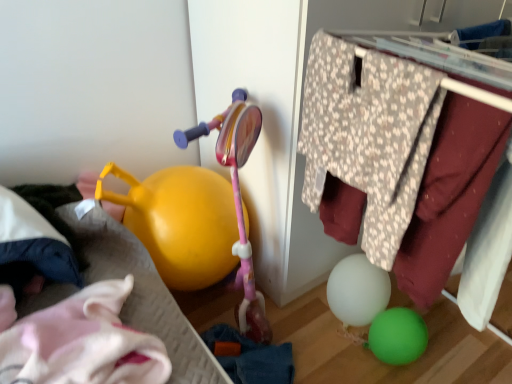
The width and height of the screenshot is (512, 384). What do you see at coordinates (104, 323) in the screenshot?
I see `yellow plastic watering can at left` at bounding box center [104, 323].

Measure the distance between floral fabric clothes hanger at upper right and camera.

floral fabric clothes hanger at upper right and camera are 57.02 centimeters apart.

What is the approximate height of floral fabric clothes hanger at upper right?

floral fabric clothes hanger at upper right is 48.06 centimeters in height.

You are a GUI agent. You are given a task and a screenshot of the screen. Output one action in this format:
    pyautogui.click(x=<x>, y=<y>)
    Task: Click on the white soft pillow at left
    
    Given the screenshot: What is the action you would take?
    pyautogui.click(x=34, y=240)

From the image's perspective, is yellow plastic watering can at left located above or below white soft pillow at left?

From the image's perspective, yellow plastic watering can at left appears below white soft pillow at left.

Is yellow plastic watering can at left oriented away from white soft pillow at left?

Correct, yellow plastic watering can at left is looking away from white soft pillow at left.

Considering the relative positions of yellow plastic watering can at left and white soft pillow at left in the image provided, is yellow plastic watering can at left to the left of white soft pillow at left from the viewer's perspective?

In fact, yellow plastic watering can at left is to the right of white soft pillow at left.

Considering the positions of objects yellow plastic watering can at left and white soft pillow at left in the image provided, who is in front, yellow plastic watering can at left or white soft pillow at left?

yellow plastic watering can at left is in front.

Locate an element on the screen. The width and height of the screenshot is (512, 384). closet above the yellow plastic watering can at left (from the image's perspective) is located at coordinates (411, 169).

How many degrees apart are the facing directions of yellow plastic watering can at left and floral fabric clothes hanger at upper right?

The angular difference between yellow plastic watering can at left and floral fabric clothes hanger at upper right is 1.08 degrees.

Can you confirm if yellow plastic watering can at left is wider than floral fabric clothes hanger at upper right?

Indeed, yellow plastic watering can at left has a greater width compared to floral fabric clothes hanger at upper right.

From a real-world perspective, which object rests below the other?

In real-world perspective, yellow plastic watering can at left is lower.

You are a GUI agent. You are given a task and a screenshot of the screen. Output one action in this format:
    pyautogui.click(x=<x>, y=<y>)
    Task: Click on the clothing lying behind the floral fabric clothes hanger at upper right
    Image resolution: width=512 pixels, height=384 pixels.
    Given the screenshot: What is the action you would take?
    pyautogui.click(x=34, y=240)

Considering the positions of objects floral fabric clothes hanger at upper right and white soft pillow at left in the image provided, who is behind, floral fabric clothes hanger at upper right or white soft pillow at left?

white soft pillow at left is behind.

Is floral fabric clothes hanger at upper right looking in the opposite direction of white soft pillow at left?

floral fabric clothes hanger at upper right does not have its back to white soft pillow at left.

Is floral fabric clothes hanger at upper right taller than white soft pillow at left?

Yes, floral fabric clothes hanger at upper right is taller than white soft pillow at left.

Who is bigger, white soft pillow at left or floral fabric clothes hanger at upper right?

Bigger between the two is floral fabric clothes hanger at upper right.

Do you think white soft pillow at left is within floral fabric clothes hanger at upper right, or outside of it?

white soft pillow at left is not enclosed by floral fabric clothes hanger at upper right.

Considering the sizes of objects white soft pillow at left and floral fabric clothes hanger at upper right in the image provided, who is wider, white soft pillow at left or floral fabric clothes hanger at upper right?

floral fabric clothes hanger at upper right.

Is white soft pillow at left not near floral fabric clothes hanger at upper right?

No, there isn't a large distance between white soft pillow at left and floral fabric clothes hanger at upper right.

Is floral fabric clothes hanger at upper right not close to yellow plastic watering can at left?

floral fabric clothes hanger at upper right is actually quite close to yellow plastic watering can at left.

Considering the sizes of floral fabric clothes hanger at upper right and yellow plastic watering can at left in the image, is floral fabric clothes hanger at upper right bigger or smaller than yellow plastic watering can at left?

Clearly, floral fabric clothes hanger at upper right is smaller in size than yellow plastic watering can at left.

Considering the sizes of objects floral fabric clothes hanger at upper right and yellow plastic watering can at left in the image provided, who is thinner, floral fabric clothes hanger at upper right or yellow plastic watering can at left?

floral fabric clothes hanger at upper right.

Is floral fabric clothes hanger at upper right situated inside yellow plastic watering can at left or outside?

floral fabric clothes hanger at upper right is spatially situated outside yellow plastic watering can at left.

Is white soft pillow at left oriented towards yellow plastic watering can at left?

Yes, white soft pillow at left is aimed at yellow plastic watering can at left.

Is point (37, 247) positioned behind point (164, 359)?

Yes.

Considering the relative sizes of white soft pillow at left and yellow plastic watering can at left in the image provided, is white soft pillow at left smaller than yellow plastic watering can at left?

Indeed, white soft pillow at left has a smaller size compared to yellow plastic watering can at left.

Locate an element on the screen. The width and height of the screenshot is (512, 384). bed frame located underneath the white soft pillow at left (from a real-world perspective) is located at coordinates (104, 323).

What are the coordinates of `bed frame located behind the floral fabric clothes hanger at upper right` in the screenshot? It's located at (104, 323).

Based on their spatial positions, is white soft pillow at left or floral fabric clothes hanger at upper right closer to yellow plastic watering can at left?

white soft pillow at left.

Estimate the real-world distances between objects in this image. Which object is further from white soft pillow at left, floral fabric clothes hanger at upper right or yellow plastic watering can at left?

floral fabric clothes hanger at upper right is further to white soft pillow at left.

Considering their positions, is white soft pillow at left positioned further to floral fabric clothes hanger at upper right than yellow plastic watering can at left?

white soft pillow at left.

Based on their spatial positions, is yellow plastic watering can at left or floral fabric clothes hanger at upper right further from white soft pillow at left?

floral fabric clothes hanger at upper right lies further to white soft pillow at left than the other object.

When comparing their distances from floral fabric clothes hanger at upper right, does yellow plastic watering can at left or white soft pillow at left seem further?

white soft pillow at left.

Estimate the real-world distances between objects in this image. Which object is closer to yellow plastic watering can at left, floral fabric clothes hanger at upper right or white soft pillow at left?

Based on the image, white soft pillow at left appears to be nearer to yellow plastic watering can at left.

Image resolution: width=512 pixels, height=384 pixels. I want to click on bed frame situated between white soft pillow at left and floral fabric clothes hanger at upper right from left to right, so click(104, 323).